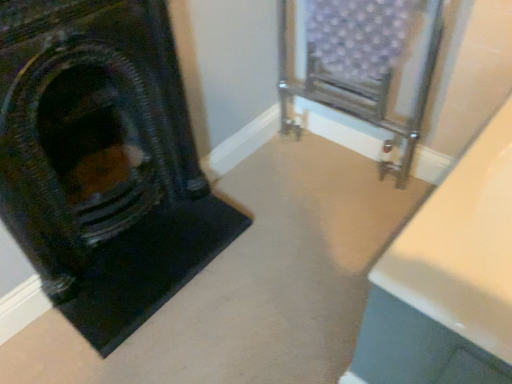
What do you see at coordinates (365, 66) in the screenshot? The width and height of the screenshot is (512, 384). I see `metallic radiator at center` at bounding box center [365, 66].

Locate an element on the screen. metallic radiator at center is located at coordinates (365, 66).

The height and width of the screenshot is (384, 512). Identify the location of matte black fireplace at left. (103, 161).

Image resolution: width=512 pixels, height=384 pixels. Describe the element at coordinates (103, 161) in the screenshot. I see `matte black fireplace at left` at that location.

This screenshot has height=384, width=512. What are the coordinates of `metallic radiator at center` in the screenshot? It's located at (365, 66).

Which object is positioned more to the left, matte black fireplace at left or metallic radiator at center?

matte black fireplace at left.

Does matte black fireplace at left lie behind metallic radiator at center?

No, the depth of matte black fireplace at left is less than that of metallic radiator at center.

Which point is more forward, (120, 230) or (400, 53)?

The point (400, 53) is closer.

From the image's perspective, is matte black fireplace at left located above or below metallic radiator at center?

From the image's perspective, matte black fireplace at left appears below metallic radiator at center.

From a real-world perspective, between matte black fireplace at left and metallic radiator at center, who is vertically lower?

From a 3D spatial view, metallic radiator at center is below.

Considering the sizes of objects matte black fireplace at left and metallic radiator at center in the image provided, who is wider, matte black fireplace at left or metallic radiator at center?

metallic radiator at center.

Between matte black fireplace at left and metallic radiator at center, which one has less height?

Standing shorter between the two is metallic radiator at center.

Who is bigger, matte black fireplace at left or metallic radiator at center?

metallic radiator at center is bigger.

Is matte black fireplace at left inside the boundaries of metallic radiator at center, or outside?

matte black fireplace at left is spatially situated outside metallic radiator at center.

Is matte black fireplace at left positioned far away from metallic radiator at center?

No, there isn't a large distance between matte black fireplace at left and metallic radiator at center.

Is matte black fireplace at left oriented towards metallic radiator at center?

No, matte black fireplace at left is not turned towards metallic radiator at center.

In the image, there is a metallic radiator at center. What are the coordinates of `fireplace below it (from the image's perspective)` in the screenshot? It's located at (103, 161).

Which object is positioned more to the left, metallic radiator at center or matte black fireplace at left?

Positioned to the left is matte black fireplace at left.

Does metallic radiator at center come in front of matte black fireplace at left?

No.

Considering the positions of point (410, 126) and point (150, 292), is point (410, 126) closer or farther from the camera than point (150, 292)?

Clearly, point (410, 126) is more distant from the camera than point (150, 292).

From the image's perspective, which object appears higher, metallic radiator at center or matte black fireplace at left?

metallic radiator at center, from the image's perspective.

From a real-world perspective, is metallic radiator at center positioned above or below matte black fireplace at left?

From a real-world perspective, metallic radiator at center is physically below matte black fireplace at left.

Can you confirm if metallic radiator at center is wider than matte black fireplace at left?

Yes, metallic radiator at center is wider than matte black fireplace at left.

Is metallic radiator at center taller than matte black fireplace at left?

In fact, metallic radiator at center may be shorter than matte black fireplace at left.

Considering the relative sizes of metallic radiator at center and matte black fireplace at left in the image provided, is metallic radiator at center smaller than matte black fireplace at left?

Actually, metallic radiator at center might be larger than matte black fireplace at left.

Do you think metallic radiator at center is within matte black fireplace at left, or outside of it?

metallic radiator at center is spatially situated outside matte black fireplace at left.

Is metallic radiator at center not near matte black fireplace at left?

That's not correct — metallic radiator at center is a little close to matte black fireplace at left.

Does metallic radiator at center turn towards matte black fireplace at left?

Yes, metallic radiator at center is turned towards matte black fireplace at left.

What's the angular difference between metallic radiator at center and matte black fireplace at left's facing directions?

The angle between the facing direction of metallic radiator at center and the facing direction of matte black fireplace at left is 89.3 degrees.

How much distance is there between metallic radiator at center and matte black fireplace at left?

They are 26.73 inches apart.

This screenshot has height=384, width=512. Identify the location of fireplace lying below the metallic radiator at center (from the image's perspective). (103, 161).

Find the location of a particular element. The image size is (512, 384). fireplace that appears below the metallic radiator at center (from the image's perspective) is located at coordinates (103, 161).

This screenshot has height=384, width=512. I want to click on furniture on the right side of matte black fireplace at left, so click(365, 66).